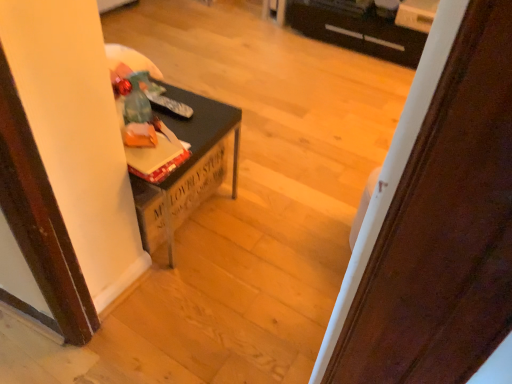
Question: Does wooden door at center have a smaller size compared to matte black table at left?

Choices:
 (A) no
 (B) yes

Answer: (B)

Question: Is wooden door at center facing towards matte black table at left?

Choices:
 (A) no
 (B) yes

Answer: (B)

Question: Can matte black table at left be found inside wooden door at center?

Choices:
 (A) yes
 (B) no

Answer: (B)

Question: From a real-world perspective, is wooden door at center below matte black table at left?

Choices:
 (A) yes
 (B) no

Answer: (B)

Question: Considering the relative sizes of wooden door at center and matte black table at left in the image provided, is wooden door at center taller than matte black table at left?

Choices:
 (A) no
 (B) yes

Answer: (B)

Question: Is wooden door at center shorter than matte black table at left?

Choices:
 (A) yes
 (B) no

Answer: (B)

Question: Is wooden door at center taller than black plastic drawer at upper center?

Choices:
 (A) yes
 (B) no

Answer: (A)

Question: From the image's perspective, is wooden door at center located beneath black plastic drawer at upper center?

Choices:
 (A) yes
 (B) no

Answer: (A)

Question: Is wooden door at center further to the viewer compared to black plastic drawer at upper center?

Choices:
 (A) no
 (B) yes

Answer: (A)

Question: Is wooden door at center to the left of black plastic drawer at upper center from the viewer's perspective?

Choices:
 (A) no
 (B) yes

Answer: (B)

Question: Is wooden door at center smaller than black plastic drawer at upper center?

Choices:
 (A) yes
 (B) no

Answer: (A)

Question: Does wooden door at center appear on the right side of black plastic drawer at upper center?

Choices:
 (A) no
 (B) yes

Answer: (A)

Question: Considering the relative sizes of black plastic drawer at upper center and wooden door at center in the image provided, is black plastic drawer at upper center bigger than wooden door at center?

Choices:
 (A) no
 (B) yes

Answer: (B)